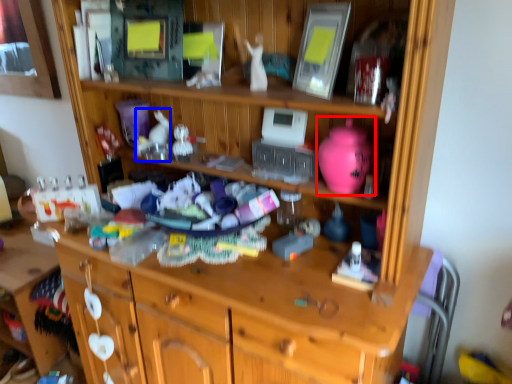
Question: Among these objects, which one is nearest to the camera, toy (highlighted by a red box) or toy (highlighted by a blue box)?

Choices:
 (A) toy
 (B) toy

Answer: (A)